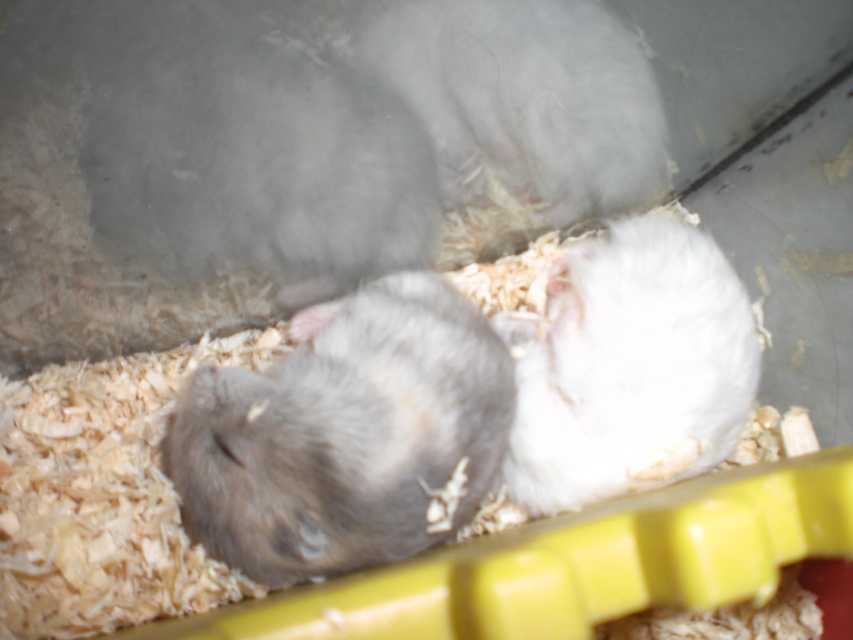
Is point (331, 484) closer to viewer compared to point (595, 422)?

Yes, it is in front of point (595, 422).

Who is positioned more to the left, gray fur hamster at center or white fluffy hamster at right?

Positioned to the left is gray fur hamster at center.

Describe the element at coordinates (345, 435) in the screenshot. This screenshot has width=853, height=640. I see `gray fur hamster at center` at that location.

Find the location of a particular element. Image resolution: width=853 pixels, height=640 pixels. gray fur hamster at center is located at coordinates (345, 435).